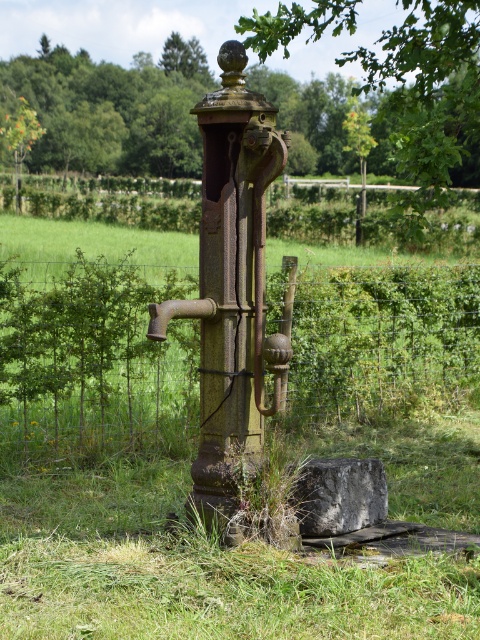
You are standing in front of the old metal water pump and notice two points marked on the pump. The first point is at coordinates point (123, 273) and the second is at point (382, 106). If you were to touch both points with your finger, which point would require you to stretch your arm further away from your body?

Point (382, 106) would require stretching your arm further because it is farther from the camera compared to point (123, 273).

You are standing at the center of the image and want to walk towards the wire mesh fence at center. Which direction should you face to walk straight towards it?

Since the wire mesh fence at center is located at point 0.572 on the x axis and 0.196 on the y axis, you should face towards the lower right direction to walk straight towards it.